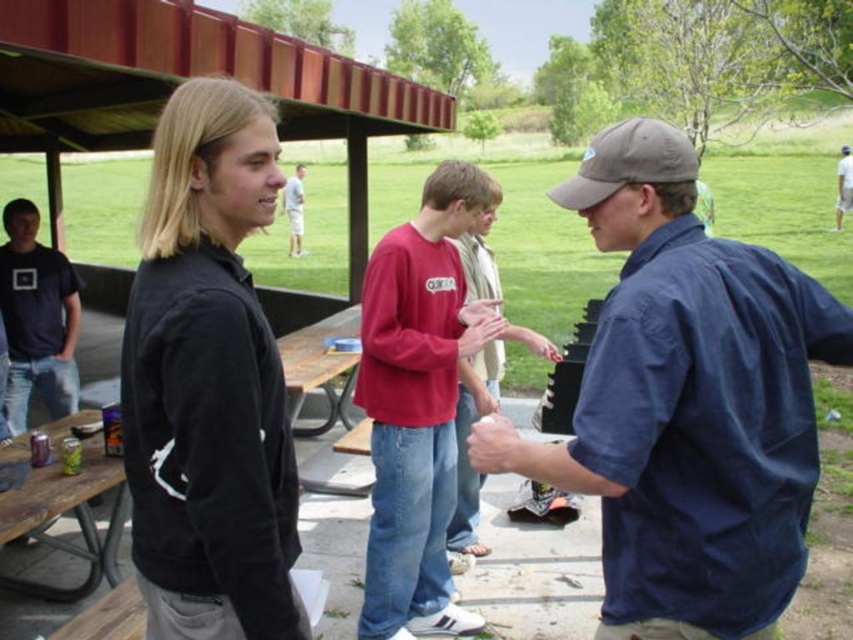
Does point (229, 460) come in front of point (288, 180)?

Yes, it is in front of point (288, 180).

Between black fleece jacket at left and red shirt at center, which one appears on the left side from the viewer's perspective?

red shirt at center

Does point (270, 202) come in front of point (300, 221)?

Yes, it is in front of point (300, 221).

Locate an element on the screen. The width and height of the screenshot is (853, 640). black fleece jacket at left is located at coordinates (207, 381).

Does red shirt at center appear under blue denim jeans at center?

Yes, red shirt at center is below blue denim jeans at center.

Is point (294, 236) in front of point (840, 173)?

Yes.

Where is `red shirt at center`? Image resolution: width=853 pixels, height=640 pixels. red shirt at center is located at coordinates (294, 209).

Can you confirm if matte red shirt at center is thinner than gray fabric baseball cap at center-right?

No, matte red shirt at center is not thinner than gray fabric baseball cap at center-right.

Between point (399, 464) and point (656, 168), which one is positioned behind?

The point (399, 464) is more distant.

Is point (405, 337) positioned behind point (654, 157)?

Yes, point (405, 337) is farther from viewer.

The image size is (853, 640). Find the location of `matte red shirt at center`. matte red shirt at center is located at coordinates (416, 404).